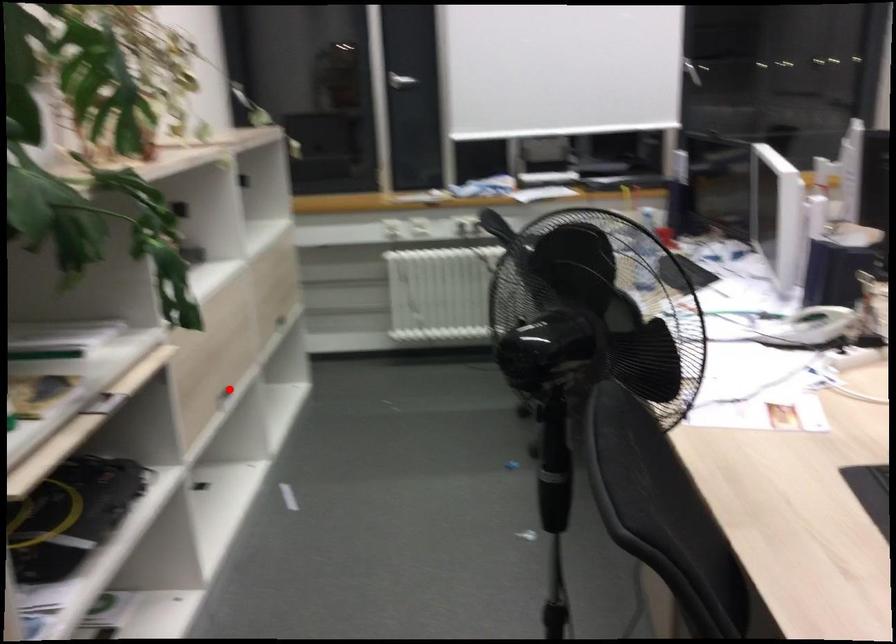
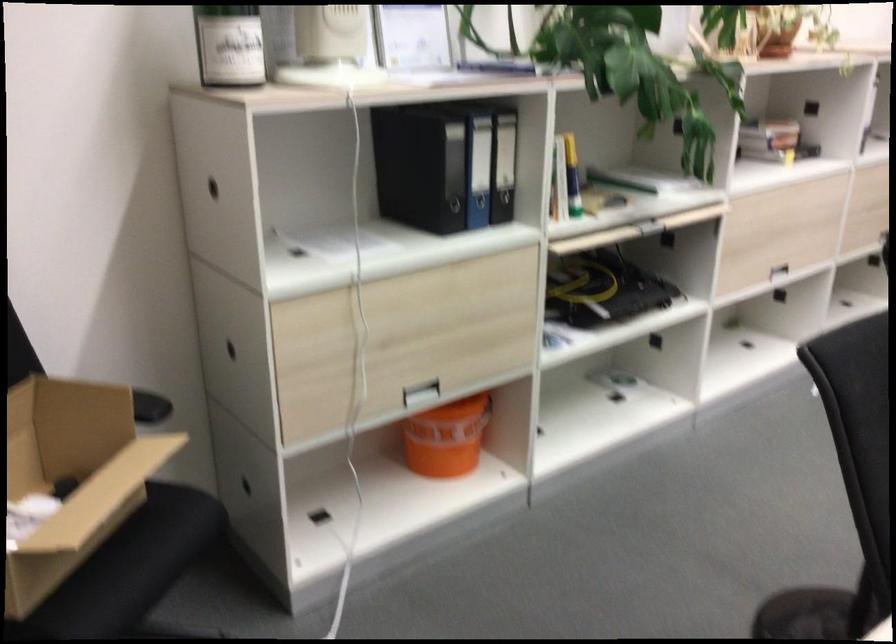
Question: I am providing you with two images of the same scene from different viewpoints. A red point is shown in image1. For the corresponding object point in image2, is it positioned nearer or farther from the camera?

Choices:
 (A) Nearer
 (B) Farther

Answer: (B)